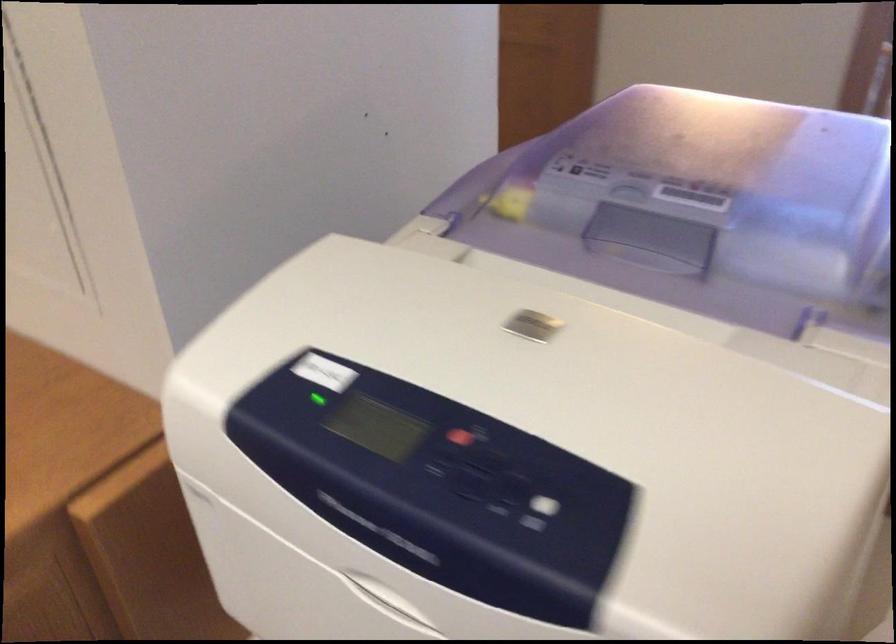
Find where to pull the recessed printer handle. Please return your answer as a coordinate pair (x, y).

(539, 325)